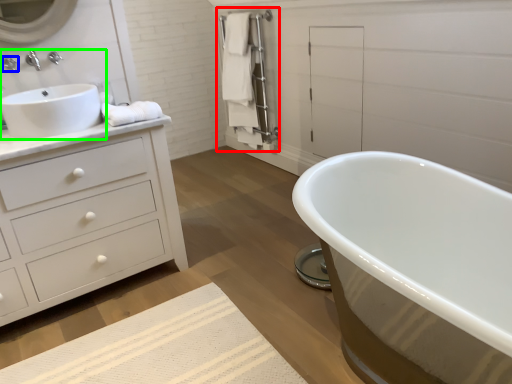
Question: Which object is positioned closest to closet (highlighted by a red box)? Select from faucet (highlighted by a blue box) and sink (highlighted by a green box).

Choices:
 (A) faucet
 (B) sink

Answer: (B)